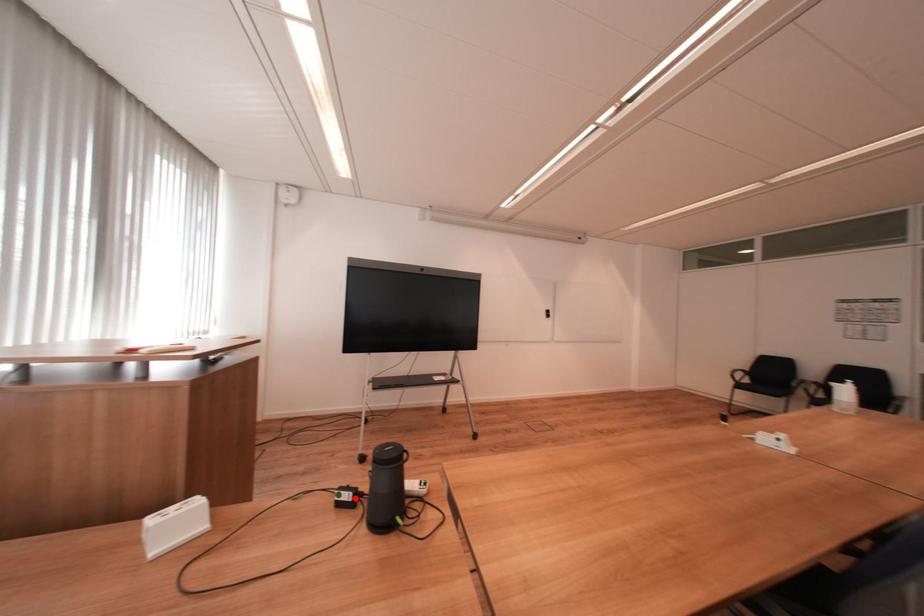
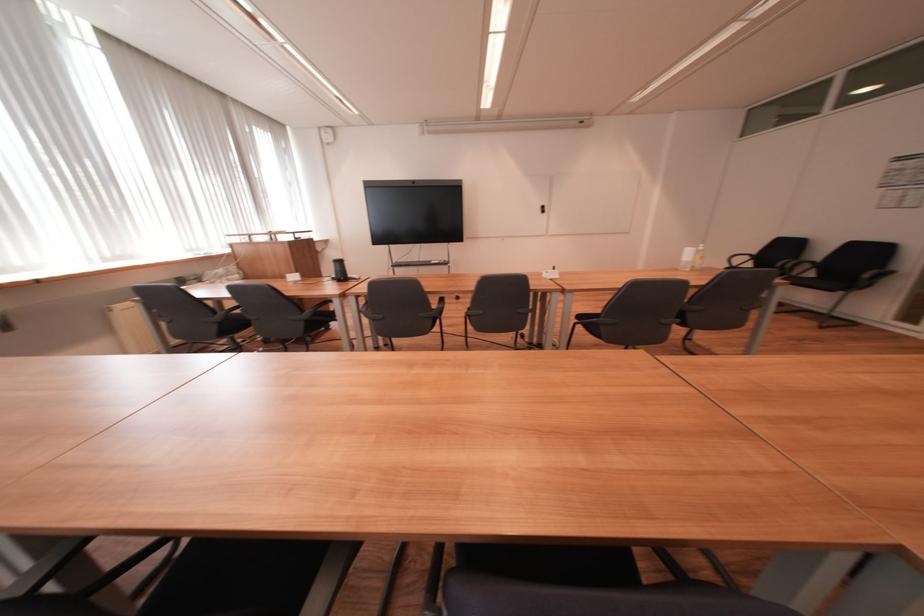
Question: I am providing you with two images of the same scene from different viewpoints. A red point is marked on the first image. At the location where the point appears in image 1, is it still visible in image 2?

Choices:
 (A) Yes
 (B) No

Answer: (A)